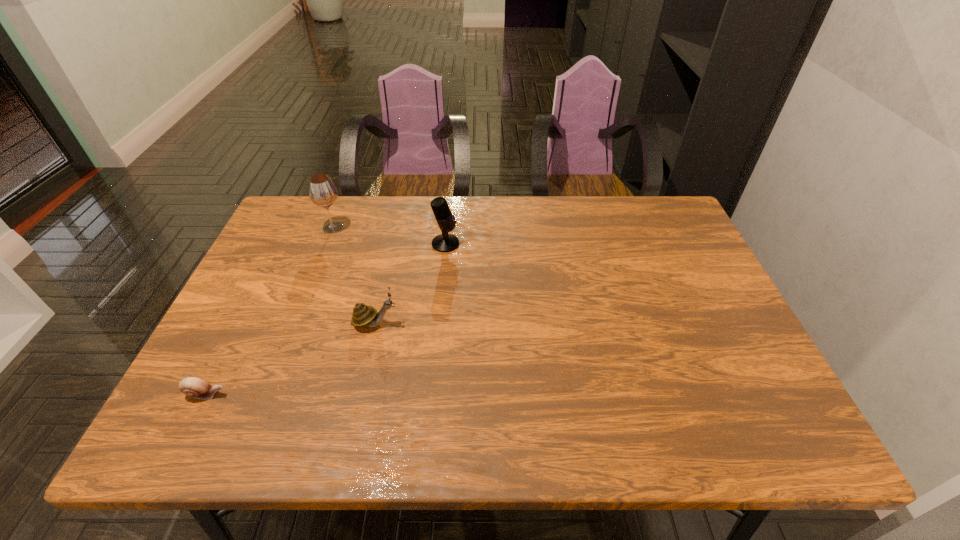
This screenshot has width=960, height=540. Find the location of `wineglass situated at the far edge`. wineglass situated at the far edge is located at coordinates (322, 192).

Where is `microphone at the far edge`? This screenshot has width=960, height=540. microphone at the far edge is located at coordinates (445, 242).

This screenshot has width=960, height=540. What are the coordinates of `wineglass present at the left edge` in the screenshot? It's located at (322, 192).

What are the coordinates of `escargot located at the left edge` in the screenshot? It's located at (194, 387).

The image size is (960, 540). I want to click on object that is at the far left corner, so [322, 192].

In the image, there is a desktop. In order to click on vacant space at the far edge in this screenshot , I will do `click(477, 219)`.

This screenshot has height=540, width=960. I want to click on blank space at the near edge, so click(605, 423).

The height and width of the screenshot is (540, 960). I want to click on vacant space at the right edge of the desktop, so click(x=736, y=404).

In the image, there is a desktop. At what (x,y) coordinates should I click in order to perform the action: click on vacant area at the far left corner. Please return your answer as a coordinate pair (x, y). Looking at the image, I should click on (323, 208).

In the image, there is a desktop. Where is `vacant area at the near left corner`? The image size is (960, 540). vacant area at the near left corner is located at coordinates (211, 435).